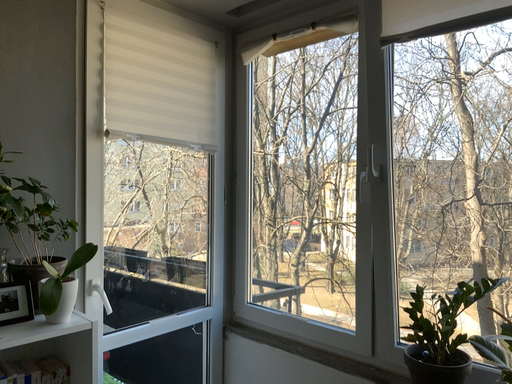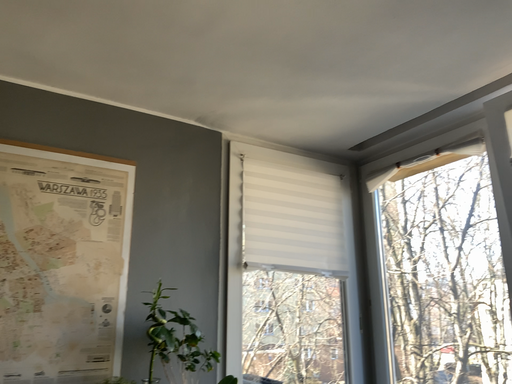
Question: Which way did the camera rotate in the video?

Choices:
 (A) rotated upward
 (B) rotated downward

Answer: (A)